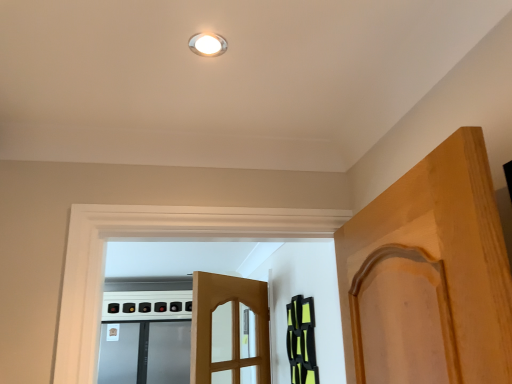
Where is `black matte cabinet at right`? The height and width of the screenshot is (384, 512). black matte cabinet at right is located at coordinates (301, 340).

Measure the distance between point (129, 349) and camera.

Point (129, 349) and camera are 3.89 meters apart from each other.

I want to click on satin silver screen door at lower left, so click(146, 353).

Where is `black matte cabinet at right`? black matte cabinet at right is located at coordinates (301, 340).

Is white glossy light fixture at upper center placed right next to satin silver screen door at lower left?

There is a gap between white glossy light fixture at upper center and satin silver screen door at lower left.

Locate an element on the screen. screen door behind the white glossy light fixture at upper center is located at coordinates (146, 353).

From the image's perspective, which one is positioned higher, white glossy light fixture at upper center or satin silver screen door at lower left?

white glossy light fixture at upper center, from the image's perspective.

From the image's perspective, between black matte cabinet at right and white glossy light fixture at upper center, who is located below?

black matte cabinet at right, from the image's perspective.

Would you say black matte cabinet at right is a long distance from white glossy light fixture at upper center?

Indeed, black matte cabinet at right is not near white glossy light fixture at upper center.

Is black matte cabinet at right closer to camera compared to white glossy light fixture at upper center?

No, it is behind white glossy light fixture at upper center.

Is satin silver screen door at lower left smaller than white glossy light fixture at upper center?

No, satin silver screen door at lower left is not smaller than white glossy light fixture at upper center.

Between satin silver screen door at lower left and white glossy light fixture at upper center, which one has smaller width?

With smaller width is white glossy light fixture at upper center.

From the image's perspective, is satin silver screen door at lower left beneath white glossy light fixture at upper center?

Correct, satin silver screen door at lower left appears lower than white glossy light fixture at upper center in the image.

Locate an element on the screen. This screenshot has width=512, height=384. light fixture on the right of the satin silver screen door at lower left is located at coordinates (207, 45).

Which object is more forward, satin silver screen door at lower left or black matte cabinet at right?

Positioned in front is black matte cabinet at right.

Can you confirm if satin silver screen door at lower left is positioned to the right of black matte cabinet at right?

No.

This screenshot has width=512, height=384. In order to click on screen door beneath the black matte cabinet at right (from a real-world perspective) in this screenshot , I will do `click(146, 353)`.

Based on their positions, is black matte cabinet at right located to the left or right of satin silver screen door at lower left?

In the image, black matte cabinet at right appears on the right side of satin silver screen door at lower left.

Does black matte cabinet at right lie in front of satin silver screen door at lower left?

Yes, black matte cabinet at right is in front of satin silver screen door at lower left.

Which is nearer, (306, 355) or (185, 342)?

Positioned in front is point (306, 355).

Is black matte cabinet at right not within satin silver screen door at lower left?

That's correct, black matte cabinet at right is outside of satin silver screen door at lower left.

Which is closer to the camera, (214,37) or (289,317)?

Clearly, point (214,37) is closer to the camera than point (289,317).

In the scene shown: Considering the sizes of white glossy light fixture at upper center and black matte cabinet at right in the image, is white glossy light fixture at upper center taller or shorter than black matte cabinet at right?

In the image, white glossy light fixture at upper center appears to be shorter than black matte cabinet at right.

Does white glossy light fixture at upper center contain black matte cabinet at right?

No.

Is white glossy light fixture at upper center wider than black matte cabinet at right?

Yes, white glossy light fixture at upper center is wider than black matte cabinet at right.

In the image, there is a satin silver screen door at lower left. What are the coordinates of `light fixture above it (from the image's perspective)` in the screenshot? It's located at (207, 45).

Where is `cabinetry lying on the right of white glossy light fixture at upper center`? The width and height of the screenshot is (512, 384). cabinetry lying on the right of white glossy light fixture at upper center is located at coordinates (301, 340).

Based on their spatial positions, is black matte cabinet at right or white glossy light fixture at upper center closer to satin silver screen door at lower left?

Based on the image, black matte cabinet at right appears to be nearer to satin silver screen door at lower left.

From the image, which object appears to be farther from black matte cabinet at right, white glossy light fixture at upper center or satin silver screen door at lower left?

Among the two, satin silver screen door at lower left is located further to black matte cabinet at right.

Estimate the real-world distances between objects in this image. Which object is further from black matte cabinet at right, satin silver screen door at lower left or white glossy light fixture at upper center?

satin silver screen door at lower left is positioned further to the anchor black matte cabinet at right.

Looking at the image, which one is located closer to white glossy light fixture at upper center, satin silver screen door at lower left or black matte cabinet at right?

black matte cabinet at right is positioned closer to the anchor white glossy light fixture at upper center.

When comparing their distances from white glossy light fixture at upper center, does black matte cabinet at right or satin silver screen door at lower left seem further?

Based on the image, satin silver screen door at lower left appears to be further to white glossy light fixture at upper center.

Looking at the image, which one is located further to satin silver screen door at lower left, white glossy light fixture at upper center or black matte cabinet at right?

The object further to satin silver screen door at lower left is white glossy light fixture at upper center.

Where is `cabinetry positioned between white glossy light fixture at upper center and satin silver screen door at lower left from near to far`? The height and width of the screenshot is (384, 512). cabinetry positioned between white glossy light fixture at upper center and satin silver screen door at lower left from near to far is located at coordinates (301, 340).